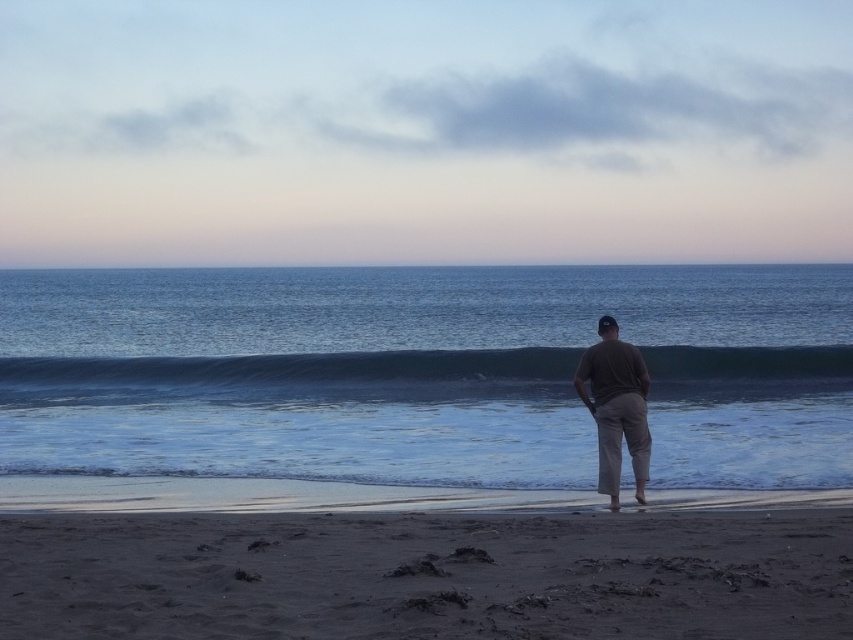
You are standing on the beach and want to place a small flag exactly at the location of the dark sand at lower center. According to the coordinates provided, where should you place the flag?

The dark sand at lower center is located at coordinates point (427, 576), so you should place the flag there.